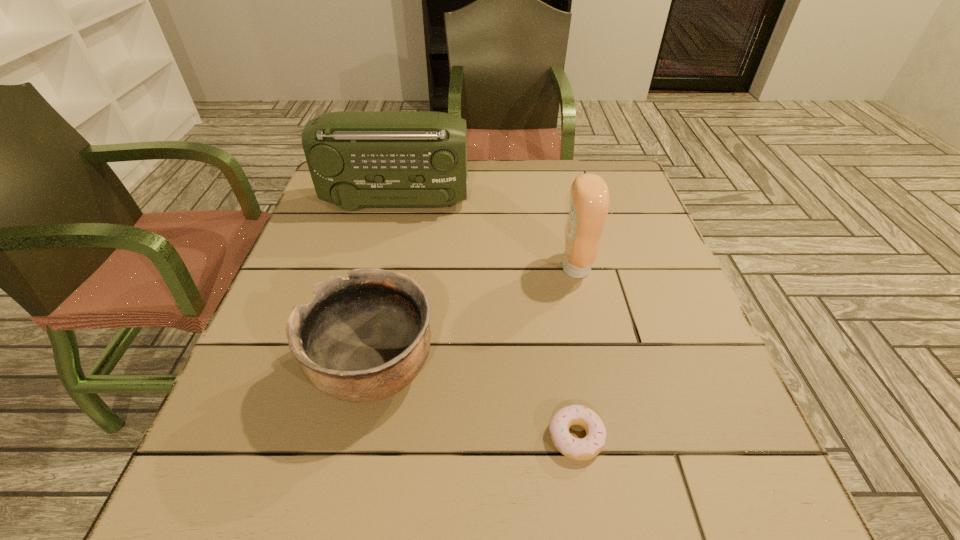
Where is `vacant area that lies between the third tallest object and the condiment`? The width and height of the screenshot is (960, 540). vacant area that lies between the third tallest object and the condiment is located at coordinates (475, 319).

This screenshot has width=960, height=540. Find the location of `vacant area that lies between the pottery and the third nearest object`. vacant area that lies between the pottery and the third nearest object is located at coordinates (475, 319).

Identify the location of vacant area that lies between the third nearest object and the shortest object. (576, 352).

This screenshot has height=540, width=960. In order to click on free space between the shortest object and the condiment in this screenshot , I will do `click(576, 352)`.

Locate an element on the screen. unoccupied position between the condiment and the doughnut is located at coordinates (576, 352).

The width and height of the screenshot is (960, 540). What are the coordinates of `vacant area that lies between the doughnut and the pottery` in the screenshot? It's located at (475, 403).

The image size is (960, 540). What are the coordinates of `free space between the farthest object and the second farthest object` in the screenshot? It's located at (486, 235).

This screenshot has width=960, height=540. What are the coordinates of `empty space that is in between the shortest object and the third nearest object` in the screenshot? It's located at (576, 352).

Identify which object is the third closest to the pottery. Please provide its 2D coordinates. Your answer should be formatted as a tuple, i.e. [(x, y)], where the tuple contains the x and y coordinates of a point satisfying the conditions above.

[(356, 159)]

Find the location of `object that is the second closest to the doughnut`. object that is the second closest to the doughnut is located at coordinates (589, 196).